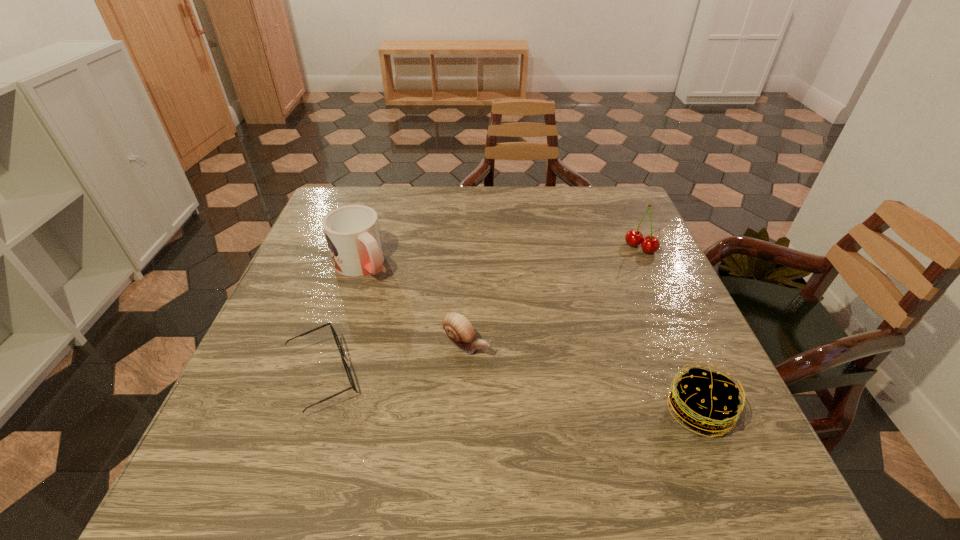
I want to click on mug located in the left edge section of the desktop, so pyautogui.click(x=352, y=232).

Locate an element on the screen. Image resolution: width=960 pixels, height=540 pixels. patty located in the right edge section of the desktop is located at coordinates (705, 400).

This screenshot has width=960, height=540. What are the coordinates of `cherry located in the right edge section of the desktop` in the screenshot? It's located at (649, 244).

The height and width of the screenshot is (540, 960). I want to click on object at the near left corner, so click(337, 341).

Locate an element on the screen. The height and width of the screenshot is (540, 960). object that is positioned at the near right corner is located at coordinates click(705, 400).

Find the location of a particular element. The height and width of the screenshot is (540, 960). vacant point at the far edge is located at coordinates (394, 209).

Where is `vacant position at the near edge of the desktop`? Image resolution: width=960 pixels, height=540 pixels. vacant position at the near edge of the desktop is located at coordinates (587, 404).

In the image, there is a desktop. Where is `vacant space at the left edge`? vacant space at the left edge is located at coordinates (276, 362).

Where is `free space at the right edge`? The image size is (960, 540). free space at the right edge is located at coordinates (697, 325).

In the image, there is a desktop. Find the location of `free space at the far left corner`. free space at the far left corner is located at coordinates (370, 187).